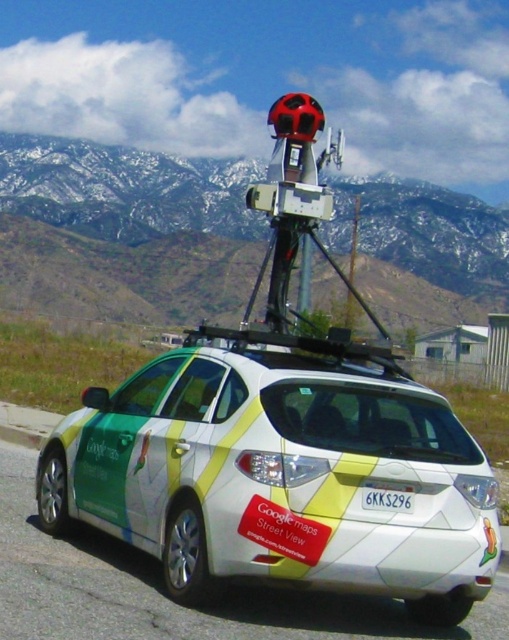
Which is above, white glossy car at center or snowy rock mountain at upper center?

snowy rock mountain at upper center

Locate an element on the screen. The image size is (509, 640). white glossy car at center is located at coordinates tap(279, 472).

Between point (483, 301) and point (411, 509), which one is positioned in front?

Point (411, 509) is in front.

In order to click on snowy rock mountain at upper center in this screenshot , I will do `click(126, 189)`.

Who is positioned more to the left, white glossy car at center or white plastic license plate at rear?

From the viewer's perspective, white glossy car at center appears more on the left side.

Can you confirm if white glossy car at center is positioned above white plastic license plate at rear?

Yes, white glossy car at center is above white plastic license plate at rear.

Is point (284, 480) positioned behind point (397, 502)?

That is False.

This screenshot has height=640, width=509. What are the coordinates of `white glossy car at center` in the screenshot? It's located at (x=279, y=472).